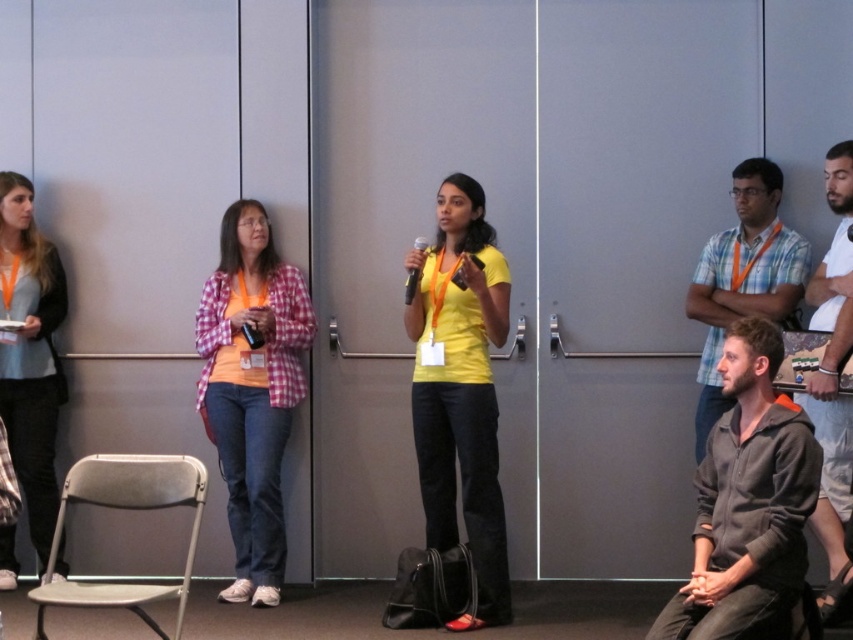
Does blue plaid shirt at right lie in front of beige cotton t-shirt at upper right?

No, blue plaid shirt at right is behind beige cotton t-shirt at upper right.

Is point (755, 275) in front of point (846, 330)?

No, (755, 275) is further to viewer.

Where is `blue plaid shirt at right`? blue plaid shirt at right is located at coordinates (743, 278).

Is gray fleece jacket at lower right above metallic gray folding chair at lower left?

Indeed, gray fleece jacket at lower right is positioned over metallic gray folding chair at lower left.

From the picture: Does gray fleece jacket at lower right have a lesser height compared to metallic gray folding chair at lower left?

Incorrect, gray fleece jacket at lower right's height does not fall short of metallic gray folding chair at lower left's.

This screenshot has width=853, height=640. What do you see at coordinates (750, 508) in the screenshot? I see `gray fleece jacket at lower right` at bounding box center [750, 508].

I want to click on gray fleece jacket at lower right, so click(750, 508).

Who is more forward, [26,218] or [701,301]?

Point [701,301] is more forward.

What do you see at coordinates (30, 355) in the screenshot? The width and height of the screenshot is (853, 640). I see `matte blue sweater at left` at bounding box center [30, 355].

Identify the location of matte blue sweater at left. (30, 355).